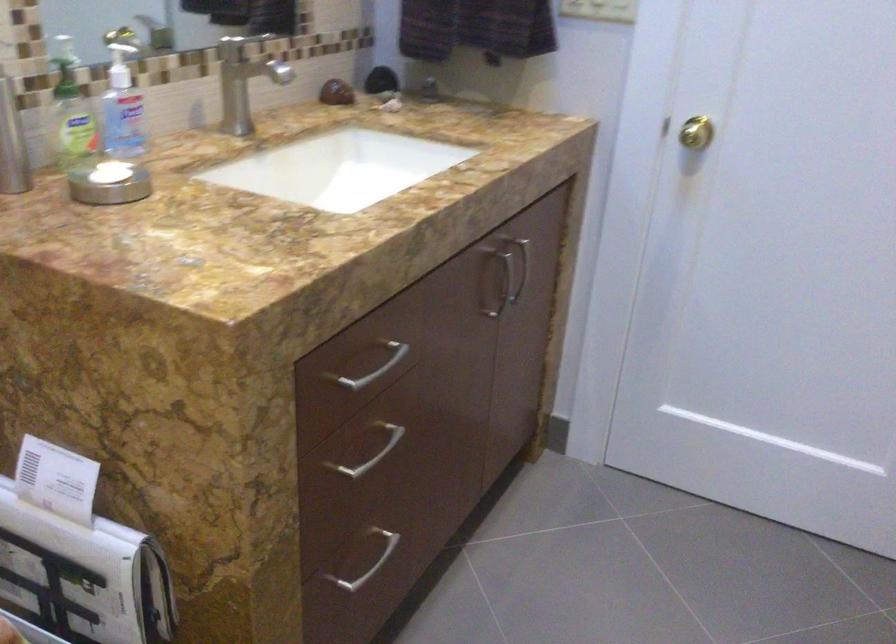
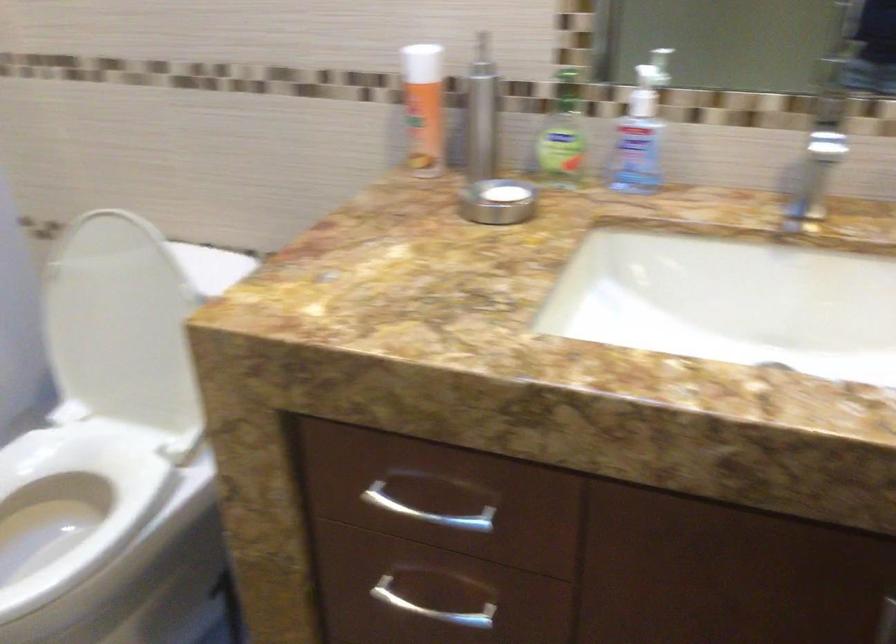
First-person continuous shooting, in which direction is the camera rotating?

The camera rotated toward left-down.